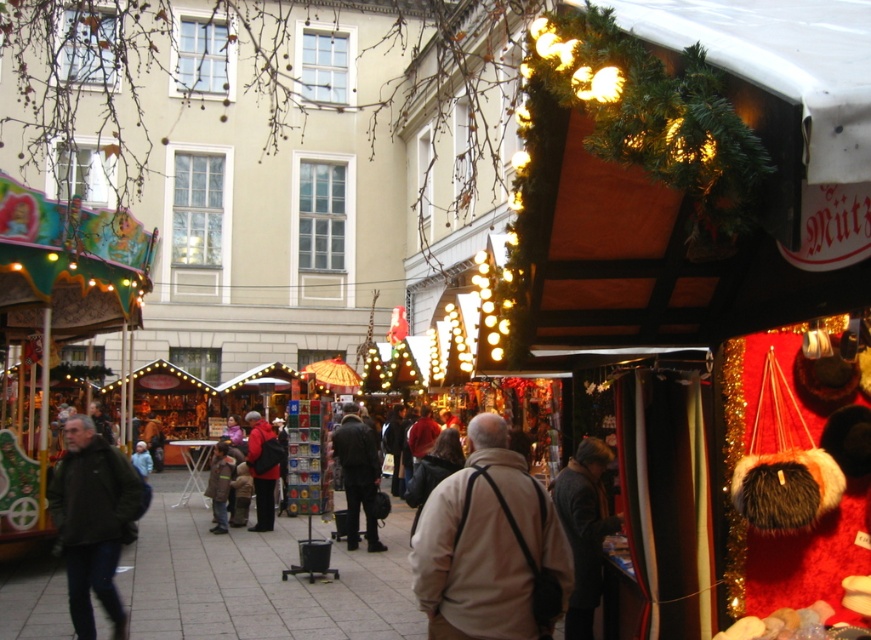
Question: Is the position of beige fabric jacket at center more distant than that of red fabric jacket at center?

Choices:
 (A) no
 (B) yes

Answer: (A)

Question: Is beige fabric jacket at center smaller than dark brown leather jacket at center?

Choices:
 (A) no
 (B) yes

Answer: (B)

Question: Does dark gray leather jacket at center have a smaller size compared to red fabric jacket at center?

Choices:
 (A) yes
 (B) no

Answer: (B)

Question: Which point is farther to the camera?

Choices:
 (A) (215, 467)
 (B) (559, 561)
 (C) (345, 497)
 (D) (272, 476)

Answer: (C)

Question: Which point is farther to the camera?

Choices:
 (A) dark gray leather jacket at center
 (B) red fabric jacket at center

Answer: (B)

Question: Among these points, which one is farthest from the camera?

Choices:
 (A) (420, 579)
 (B) (349, 516)
 (C) (258, 460)

Answer: (C)